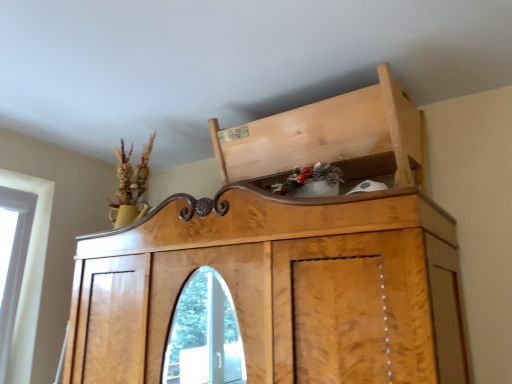
Question: Would you say wooden cabinet at upper center is to the left or to the right of natural wood cabinet at upper center in the picture?

Choices:
 (A) right
 (B) left

Answer: (B)

Question: Does point (358, 292) appear closer or farther from the camera than point (389, 144)?

Choices:
 (A) farther
 (B) closer

Answer: (B)

Question: Relative to natural wood cabinet at upper center, is wooden cabinet at upper center in front or behind?

Choices:
 (A) front
 (B) behind

Answer: (A)

Question: Is natural wood cabinet at upper center bigger or smaller than wooden cabinet at upper center?

Choices:
 (A) small
 (B) big

Answer: (A)

Question: Is point (396, 100) positioned closer to the camera than point (260, 306)?

Choices:
 (A) closer
 (B) farther

Answer: (B)

Question: Relative to wooden cabinet at upper center, is natural wood cabinet at upper center in front or behind?

Choices:
 (A) behind
 (B) front

Answer: (A)

Question: Do you think natural wood cabinet at upper center is within wooden cabinet at upper center, or outside of it?

Choices:
 (A) inside
 (B) outside

Answer: (B)